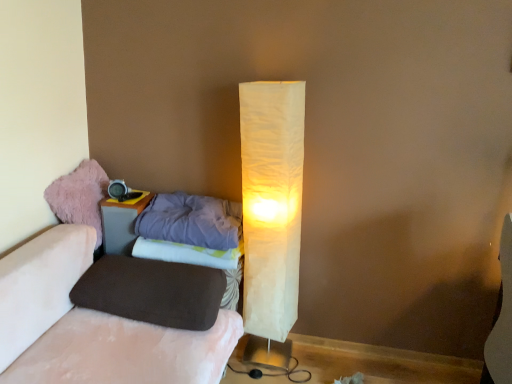
Locate an element on the screen. This screenshot has height=384, width=512. vacant space in white paper lamp at center (from a real-world perspective) is located at coordinates (264, 359).